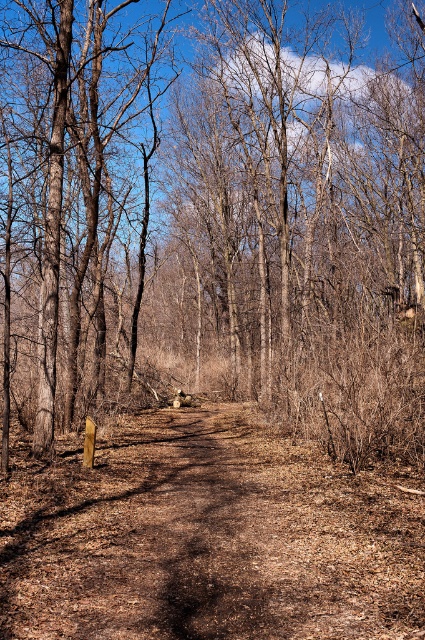
You are a hiker walking along the dirt path in the forest. You notice brown dry leaves at center and a brown rough tree at left. Which object is bigger in size?

The brown dry leaves at center has a larger size compared to the brown rough tree at left.